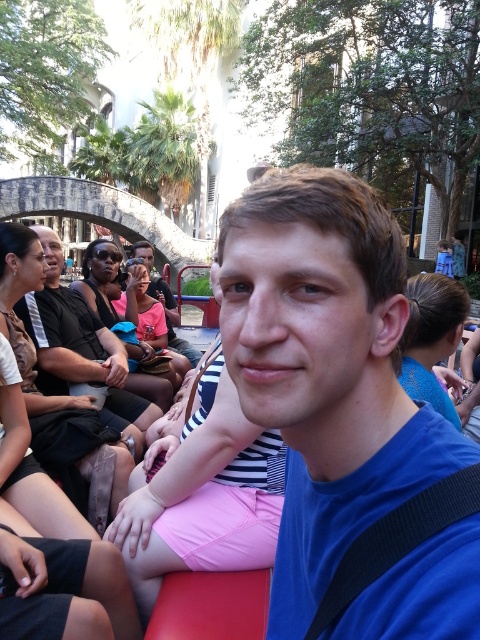
You are a photographer trying to capture a photo of the blue matte shirt at center and the matte pink shirt at center. Which shirt should you focus on first to ensure both are in focus?

The blue matte shirt at center is closer to the viewer than the matte pink shirt at center. To ensure both are in focus, focus on the blue matte shirt at center first, as it is closer, and the matte pink shirt at center will be in the background.

You are a photographer trying to capture a group photo of the people on the boat. You notice the blue matte shirt at center and the matte black shirt at center. Which shirt should you position to the left to ensure both are visible in the frame?

The matte black shirt at center should be positioned to the left because the blue matte shirt at center is currently to the right of it, so moving the matte black shirt to the left would keep the blue one in frame.

You are standing in front of the image and want to locate the matte black shirt at center. According to the coordinates provided, where would you find it?

The matte black shirt at center is located at point coordinates 0.542 on the x axis and 0.167 on the y axis.